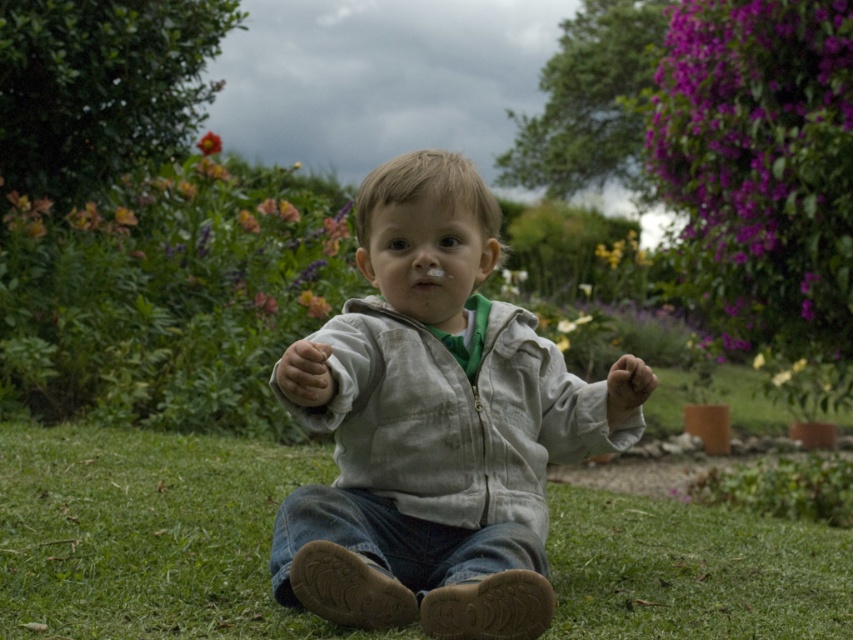
Who is lower down, light gray cotton jacket at center or purple matte flowers at upper right?

light gray cotton jacket at center is lower down.

Between point (370, 364) and point (831, 163), which one is positioned behind?

Point (831, 163)

I want to click on light gray cotton jacket at center, so click(434, 424).

Between light gray cotton jacket at center and green grass at center, which one has more height?

light gray cotton jacket at center is taller.

Can you confirm if light gray cotton jacket at center is positioned to the right of green grass at center?

Indeed, light gray cotton jacket at center is positioned on the right side of green grass at center.

The width and height of the screenshot is (853, 640). I want to click on light gray cotton jacket at center, so click(x=434, y=424).

Who is higher up, green grass at center or purple matte flowers at upper right?

purple matte flowers at upper right is above.

Is green grass at center taller than purple matte flowers at upper right?

In fact, green grass at center may be shorter than purple matte flowers at upper right.

Is point (598, 547) more distant than point (809, 298)?

That is False.

This screenshot has height=640, width=853. I want to click on green grass at center, so click(x=146, y=534).